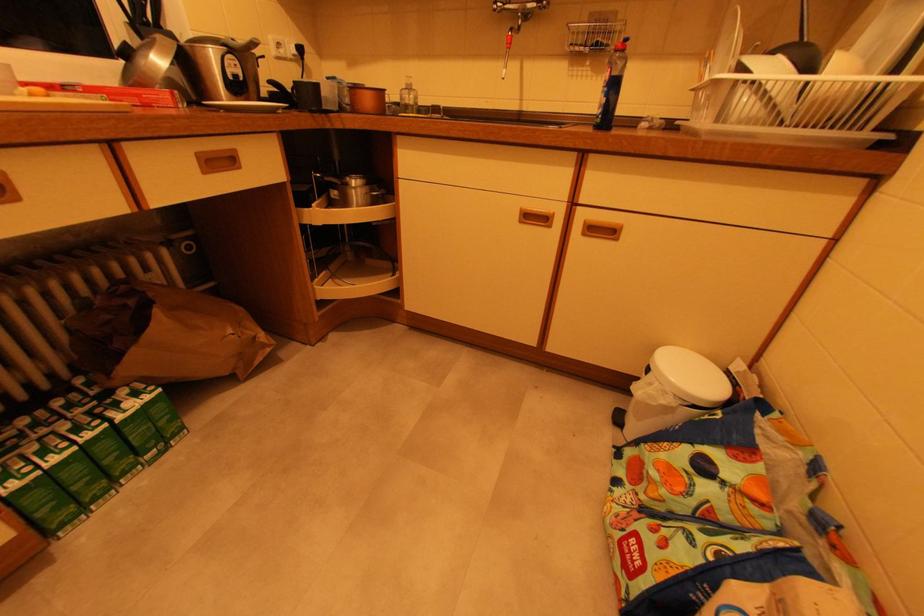
Find the location of a particular element. metal pot handle is located at coordinates (124, 51).